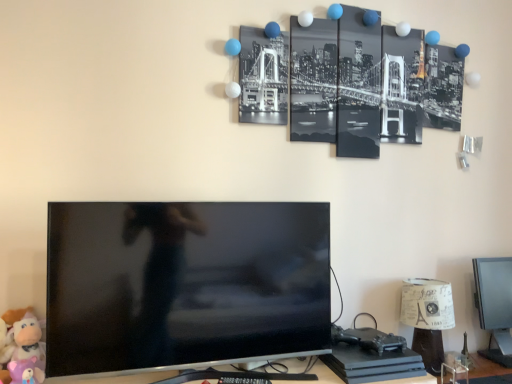
Question: Can soft plush toy at lower left, placed as the first toy when sorted from back to front, be found inside black glossy tv at center?

Choices:
 (A) no
 (B) yes

Answer: (A)

Question: Is black glossy tv at center in front of soft plush toy at lower left, placed as the second toy when sorted from front to back?

Choices:
 (A) no
 (B) yes

Answer: (B)

Question: From a real-world perspective, does black glossy tv at center stand above soft plush toy at lower left, placed as the second toy when sorted from front to back?

Choices:
 (A) no
 (B) yes

Answer: (B)

Question: Can you confirm if black glossy tv at center is shorter than soft plush toy at lower left, placed as the second toy when sorted from front to back?

Choices:
 (A) no
 (B) yes

Answer: (A)

Question: Can you confirm if black glossy tv at center is wider than soft plush toy at lower left, placed as the first toy when sorted from back to front?

Choices:
 (A) no
 (B) yes

Answer: (B)

Question: Is point (17, 332) closer or farther from the camera than point (148, 334)?

Choices:
 (A) closer
 (B) farther

Answer: (B)

Question: From the image's perspective, is soft plush toy at lower left, placed as the second toy when sorted from front to back, positioned above or below black glossy tv at center?

Choices:
 (A) below
 (B) above

Answer: (A)

Question: From a real-world perspective, is soft plush toy at lower left, placed as the first toy when sorted from back to front, above or below black glossy tv at center?

Choices:
 (A) above
 (B) below

Answer: (B)

Question: Is soft plush toy at lower left, placed as the first toy when sorted from back to front, in front of or behind black glossy tv at center in the image?

Choices:
 (A) behind
 (B) front

Answer: (A)

Question: From a real-world perspective, is black glossy tv at center positioned above or below paper lampshade at lower right?

Choices:
 (A) below
 (B) above

Answer: (B)

Question: Considering their positions, is black glossy tv at center located in front of or behind paper lampshade at lower right?

Choices:
 (A) behind
 (B) front

Answer: (B)

Question: Is black glossy tv at center taller or shorter than paper lampshade at lower right?

Choices:
 (A) short
 (B) tall

Answer: (B)

Question: Based on their positions, is black glossy tv at center located to the left or right of paper lampshade at lower right?

Choices:
 (A) left
 (B) right

Answer: (A)

Question: Would you say plush purple bear at lower left, which ranks as the first toy in front-to-back order, is inside or outside soft plush toy at lower left, placed as the second toy when sorted from front to back?

Choices:
 (A) inside
 (B) outside

Answer: (B)

Question: Considering the relative positions of plush purple bear at lower left, which ranks as the first toy in front-to-back order, and soft plush toy at lower left, placed as the first toy when sorted from back to front, in the image provided, is plush purple bear at lower left, which ranks as the first toy in front-to-back order, to the left or to the right of soft plush toy at lower left, placed as the first toy when sorted from back to front,?

Choices:
 (A) right
 (B) left

Answer: (A)